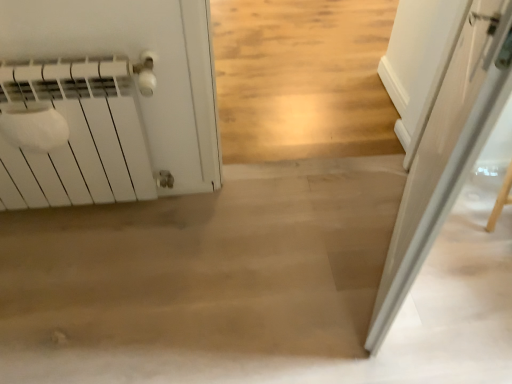
At what (x,y) coordinates should I click in order to perform the action: click on free space to the left of white glossy door at right. Please return your answer as a coordinate pair (x, y). The image size is (512, 384). Looking at the image, I should click on (270, 258).